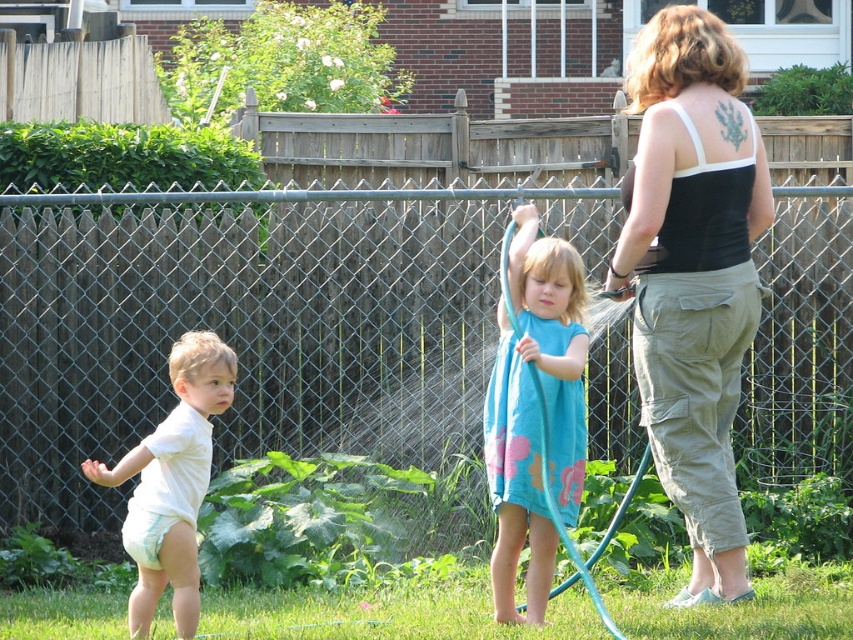
You are standing in the backyard and see the black tank top at upper right and the blue rubber hose at center. Which object is higher in position?

The black tank top at upper right is above the blue rubber hose at center, so it is higher in position.